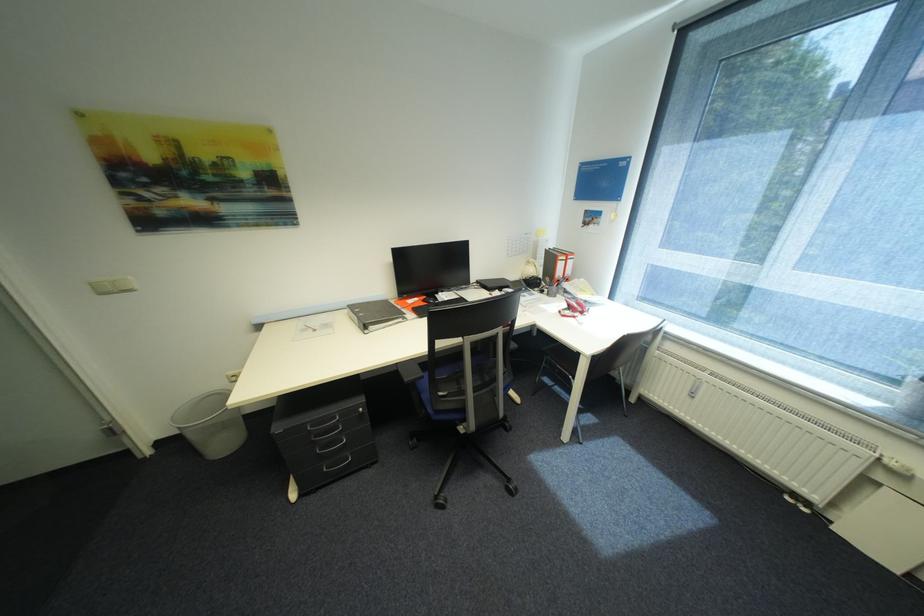
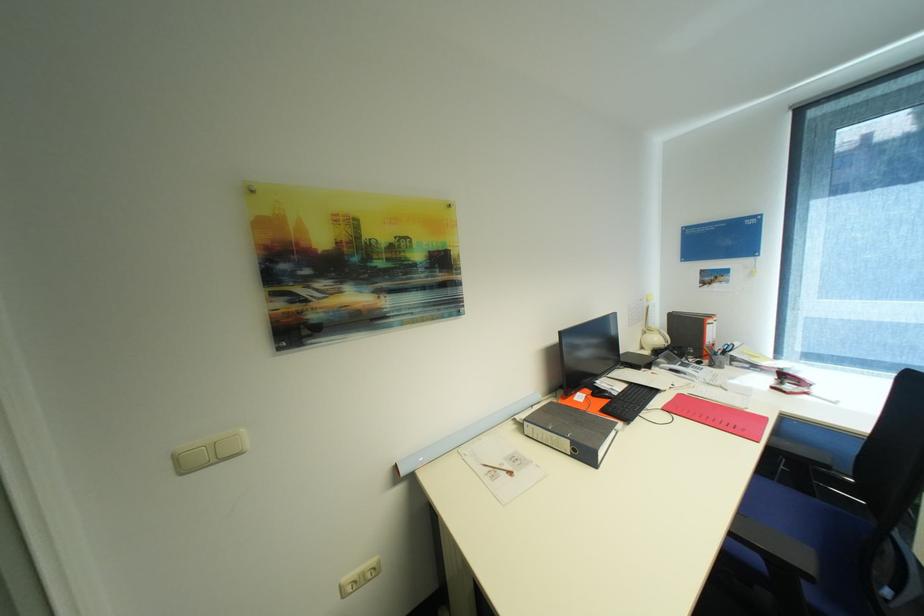
The point at (235, 377) is marked in the first image. Where is the corresponding point in the second image?

(348, 586)